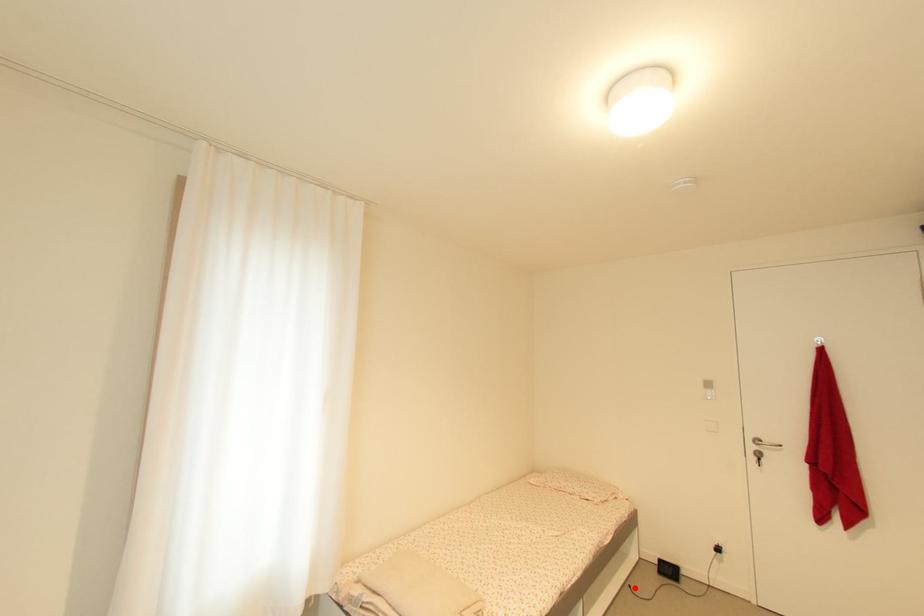
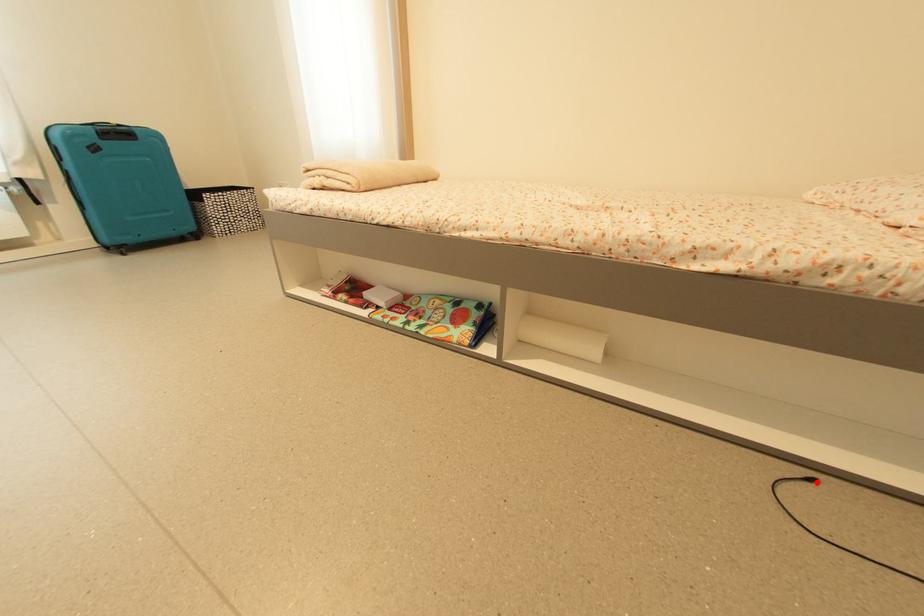
I am providing you with two images of the same scene from different viewpoints. A red point is marked on the first image and another point is marked on the second image. Does the point marked in image1 correspond to the same location as the one in image2?

Yes